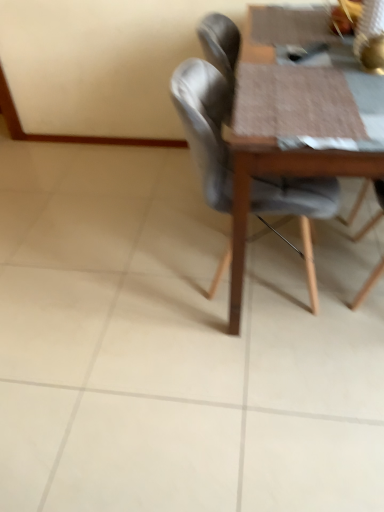
Question: Should I look upward or downward to see wooden textured table at center?

Choices:
 (A) up
 (B) down

Answer: (A)

Question: From the image's perspective, does matte gray chair at center appear lower than wooden textured table at center?

Choices:
 (A) no
 (B) yes

Answer: (B)

Question: Is the depth of matte gray chair at center greater than that of wooden textured table at center?

Choices:
 (A) no
 (B) yes

Answer: (B)

Question: From the image's perspective, would you say matte gray chair at center is positioned over wooden textured table at center?

Choices:
 (A) no
 (B) yes

Answer: (A)

Question: Is matte gray chair at center in contact with wooden textured table at center?

Choices:
 (A) no
 (B) yes

Answer: (A)

Question: Can you confirm if matte gray chair at center is smaller than wooden textured table at center?

Choices:
 (A) no
 (B) yes

Answer: (B)

Question: Is matte gray chair at center not near wooden textured table at center?

Choices:
 (A) yes
 (B) no

Answer: (B)

Question: Is wooden textured table at center not inside matte gray chair at center?

Choices:
 (A) no
 (B) yes

Answer: (B)

Question: Does wooden textured table at center appear on the left side of matte gray chair at center?

Choices:
 (A) yes
 (B) no

Answer: (B)

Question: Can you confirm if wooden textured table at center is wider than matte gray chair at center?

Choices:
 (A) no
 (B) yes

Answer: (B)

Question: Does wooden textured table at center lie in front of matte gray chair at center?

Choices:
 (A) no
 (B) yes

Answer: (B)

Question: Considering the relative sizes of wooden textured table at center and matte gray chair at center in the image provided, is wooden textured table at center smaller than matte gray chair at center?

Choices:
 (A) no
 (B) yes

Answer: (A)

Question: Is wooden textured table at center aimed at matte gray chair at center?

Choices:
 (A) yes
 (B) no

Answer: (B)

Question: Considering the relative positions of matte gray chair at center and wooden textured table at center in the image provided, is matte gray chair at center to the left or to the right of wooden textured table at center?

Choices:
 (A) left
 (B) right

Answer: (A)